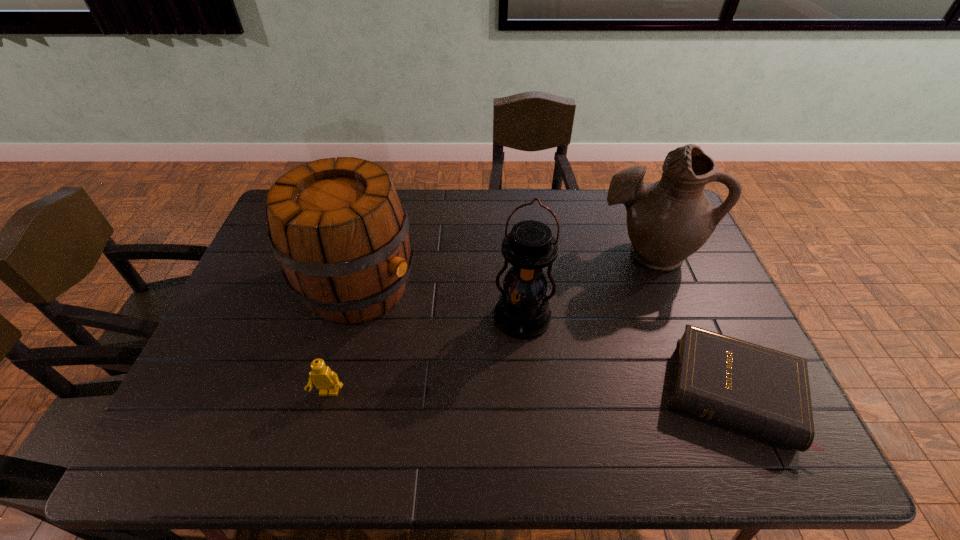
Locate an element on the screen. Image resolution: width=960 pixels, height=540 pixels. pitcher that is at the right edge is located at coordinates pos(667,221).

This screenshot has width=960, height=540. I want to click on object present at the far right corner, so click(x=667, y=221).

In order to click on object located at the near right corner in this screenshot , I will do `click(764, 392)`.

Find the location of a particular element. free spot at the far edge of the desktop is located at coordinates (548, 204).

Locate an element on the screen. This screenshot has height=540, width=960. free space at the near edge of the desktop is located at coordinates (543, 411).

You are a GUI agent. You are given a task and a screenshot of the screen. Output one action in this format:
    pyautogui.click(x=<x>, y=<y>)
    Task: Click on the free space at the left edge
    The width and height of the screenshot is (960, 540).
    Given the screenshot: What is the action you would take?
    pyautogui.click(x=275, y=270)

In the image, there is a desktop. Where is `vacant space at the right edge`? Image resolution: width=960 pixels, height=540 pixels. vacant space at the right edge is located at coordinates (684, 264).

The width and height of the screenshot is (960, 540). I want to click on free space between the lantern and the pitcher, so click(585, 286).

The width and height of the screenshot is (960, 540). Identify the location of empty space that is in between the shortest object and the third object from right to left. (627, 356).

This screenshot has height=540, width=960. Identify the location of vacant area between the lantern and the fourth tallest object. (426, 356).